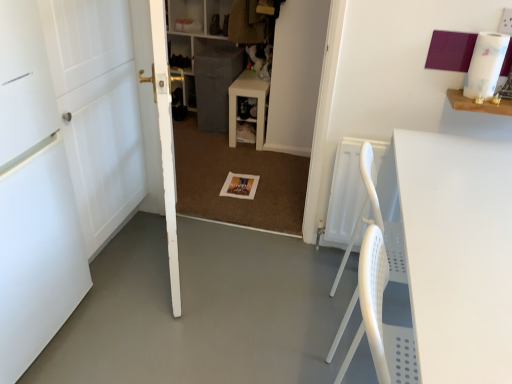
Question: From the image's perspective, would you say white wooden door at left, the 3th door when ordered from left to right, is positioned over gray fabric bookshelf at center?

Choices:
 (A) no
 (B) yes

Answer: (A)

Question: Can you confirm if white wooden door at left, which is counted as the 1th door, starting from the right, is bigger than gray fabric bookshelf at center?

Choices:
 (A) no
 (B) yes

Answer: (A)

Question: Can you confirm if white wooden door at left, the 3th door when ordered from left to right, is wider than gray fabric bookshelf at center?

Choices:
 (A) no
 (B) yes

Answer: (A)

Question: Does white wooden door at left, the 3th door when ordered from left to right, have a lesser height compared to gray fabric bookshelf at center?

Choices:
 (A) no
 (B) yes

Answer: (A)

Question: From the image's perspective, is white wooden door at left, the 3th door when ordered from left to right, below gray fabric bookshelf at center?

Choices:
 (A) no
 (B) yes

Answer: (B)

Question: Can you confirm if white wooden door at left, the 3th door when ordered from left to right, is taller than gray fabric bookshelf at center?

Choices:
 (A) no
 (B) yes

Answer: (B)

Question: Considering the relative sizes of white wood door at left, positioned as the 2th door in right-to-left order, and white matte door at left, the 3th door from the right, in the image provided, is white wood door at left, positioned as the 2th door in right-to-left order, smaller than white matte door at left, the 3th door from the right,?

Choices:
 (A) yes
 (B) no

Answer: (A)

Question: Is white wood door at left, marked as the second door in a left-to-right arrangement, taller than white matte door at left, the 3th door from the right?

Choices:
 (A) yes
 (B) no

Answer: (B)

Question: Is white matte door at left, marked as the first door in a left-to-right arrangement, surrounded by white wood door at left, positioned as the 2th door in right-to-left order?

Choices:
 (A) no
 (B) yes

Answer: (A)

Question: Can you confirm if white wood door at left, positioned as the 2th door in right-to-left order, is bigger than white matte door at left, the 3th door from the right?

Choices:
 (A) yes
 (B) no

Answer: (B)

Question: Considering the relative sizes of white wood door at left, marked as the second door in a left-to-right arrangement, and white matte door at left, marked as the first door in a left-to-right arrangement, in the image provided, is white wood door at left, marked as the second door in a left-to-right arrangement, wider than white matte door at left, marked as the first door in a left-to-right arrangement,?

Choices:
 (A) no
 (B) yes

Answer: (A)

Question: Is white wood door at left, positioned as the 2th door in right-to-left order, far away from white matte door at left, marked as the first door in a left-to-right arrangement?

Choices:
 (A) no
 (B) yes

Answer: (A)

Question: Considering the relative sizes of gray fabric cabinet at center and matte white table at center, positioned as the first table in top-to-bottom order, in the image provided, is gray fabric cabinet at center wider than matte white table at center, positioned as the first table in top-to-bottom order,?

Choices:
 (A) yes
 (B) no

Answer: (A)